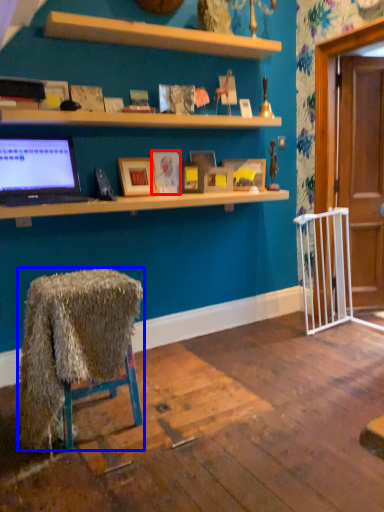
Question: Among these objects, which one is farthest to the camera, picture frame (highlighted by a red box) or desk (highlighted by a blue box)?

Choices:
 (A) picture frame
 (B) desk

Answer: (A)